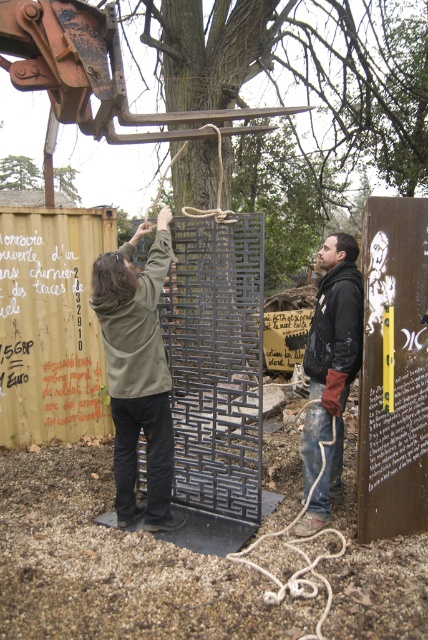
Question: Which is farther from the green matte hoodie at center?

Choices:
 (A) green leafy tree at upper left
 (B) dark brown leather jacket at right

Answer: (A)

Question: Among these objects, which one is farthest from the camera?

Choices:
 (A) dark brown leather jacket at right
 (B) green matte hoodie at center

Answer: (A)

Question: Is dark brown leather jacket at right to the left of green leafy tree at upper left from the viewer's perspective?

Choices:
 (A) no
 (B) yes

Answer: (A)

Question: Which of these objects is positioned farthest from the green matte hoodie at center?

Choices:
 (A) dark brown leather jacket at right
 (B) green leafy tree at upper left

Answer: (B)

Question: Can you confirm if green matte hoodie at center is smaller than dark brown leather jacket at right?

Choices:
 (A) yes
 (B) no

Answer: (B)

Question: From the image, what is the correct spatial relationship of green matte hoodie at center in relation to dark brown leather jacket at right?

Choices:
 (A) above
 (B) below

Answer: (A)